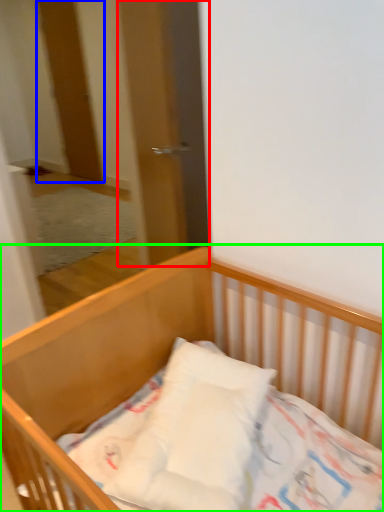
Question: Which is nearer to the screen door (highlighted by a red box)? door (highlighted by a blue box) or bed (highlighted by a green box).

Choices:
 (A) door
 (B) bed

Answer: (B)